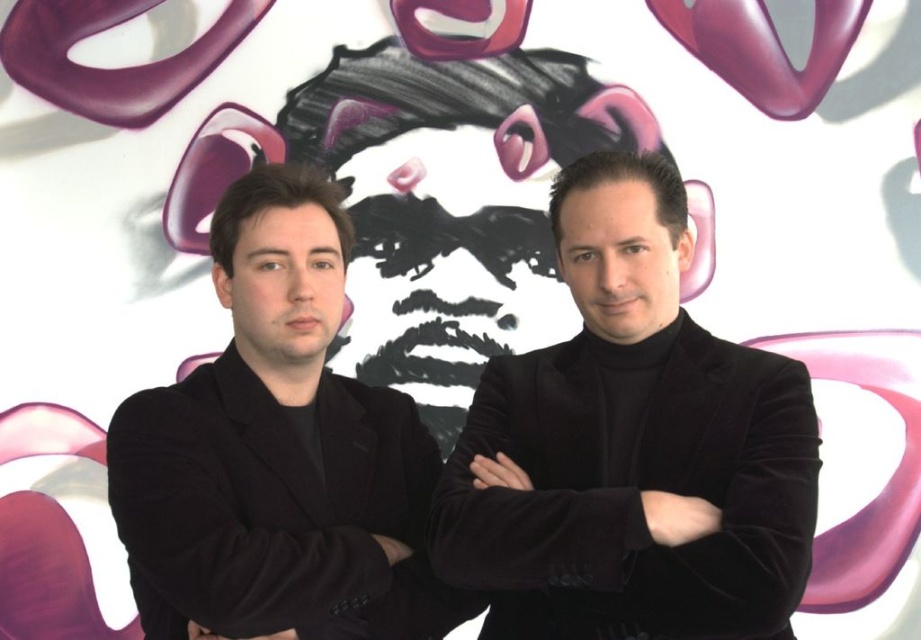
Looking at this image, does velvet black suit at center have a smaller size compared to black velvet arm at left?

No, velvet black suit at center is not smaller than black velvet arm at left.

Is velvet black suit at center taller than black velvet arm at left?

Correct, velvet black suit at center is much taller as black velvet arm at left.

Which is in front, point (670, 192) or point (375, 476)?

Point (670, 192) is in front.

You are a GUI agent. You are given a task and a screenshot of the screen. Output one action in this format:
    pyautogui.click(x=<x>, y=<y>)
    Task: Click on the velvet black suit at center
    The image size is (921, 640).
    Given the screenshot: What is the action you would take?
    [632, 448]

Locate an element on the screen. The width and height of the screenshot is (921, 640). black velvet arm at left is located at coordinates (266, 509).

Does black velvet arm at left have a lesser width compared to black velvet arm at center?

No.

This screenshot has height=640, width=921. What do you see at coordinates (266, 509) in the screenshot?
I see `black velvet arm at left` at bounding box center [266, 509].

At what (x,y) coordinates should I click in order to perform the action: click on black velvet arm at left. Please return your answer as a coordinate pair (x, y). The height and width of the screenshot is (640, 921). Looking at the image, I should click on (266, 509).

How distant is velvet black suit at center from black velvet suit at center?

velvet black suit at center and black velvet suit at center are 12.86 inches apart.

Looking at this image, which of these two, velvet black suit at center or black velvet suit at center, stands taller?

velvet black suit at center

The width and height of the screenshot is (921, 640). Describe the element at coordinates (632, 448) in the screenshot. I see `velvet black suit at center` at that location.

Locate an element on the screen. Image resolution: width=921 pixels, height=640 pixels. velvet black suit at center is located at coordinates (632, 448).